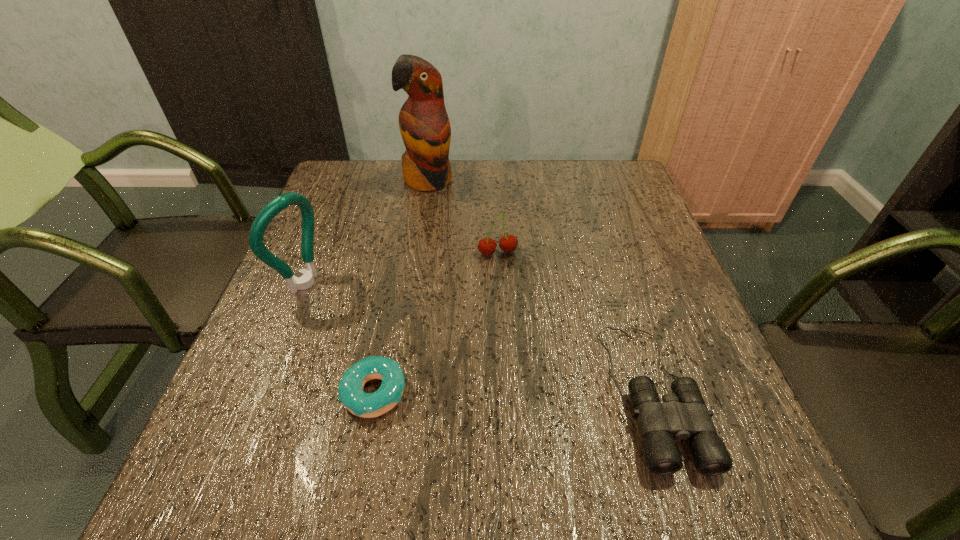
Locate an element on the screen. The image size is (960, 540). blank region between the farthest object and the leftmost object is located at coordinates (367, 232).

This screenshot has height=540, width=960. Find the location of `free space between the fourth object from left to right and the rightmost object`. free space between the fourth object from left to right and the rightmost object is located at coordinates (575, 322).

Locate an element on the screen. vacant space that is in between the doughnut and the parrot is located at coordinates (401, 286).

Where is `object that can be found as the fourth closest to the third shortest object`? Image resolution: width=960 pixels, height=540 pixels. object that can be found as the fourth closest to the third shortest object is located at coordinates [281, 202].

The height and width of the screenshot is (540, 960). I want to click on object that is the third nearest to the fourth nearest object, so click(x=350, y=389).

Where is `free point that satisfies the following two spatial constraints: 1. on the back side of the third nearest object; 2. on the left side of the fourth object from left to right`? free point that satisfies the following two spatial constraints: 1. on the back side of the third nearest object; 2. on the left side of the fourth object from left to right is located at coordinates (316, 253).